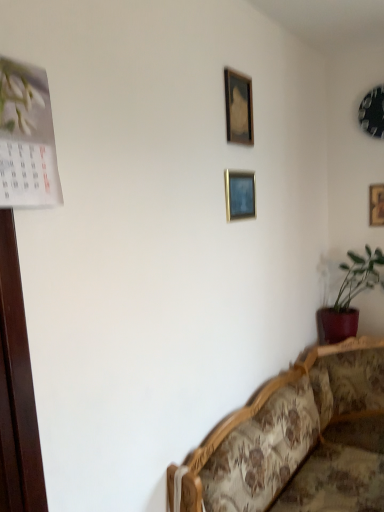
Question: Is matte wooden picture frame at upper center, the 2th picture frame from the front, surrounded by floral fabric couch at lower right?

Choices:
 (A) yes
 (B) no

Answer: (B)

Question: Does floral fabric couch at lower right have a lesser width compared to matte wooden picture frame at upper center, the third picture frame viewed from the back?

Choices:
 (A) yes
 (B) no

Answer: (B)

Question: Is floral fabric couch at lower right smaller than matte wooden picture frame at upper center, arranged as the second picture frame when viewed from the left?

Choices:
 (A) no
 (B) yes

Answer: (A)

Question: Is floral fabric couch at lower right taller than matte wooden picture frame at upper center, the 2th picture frame from the front?

Choices:
 (A) no
 (B) yes

Answer: (B)

Question: From the image's perspective, is floral fabric couch at lower right over matte wooden picture frame at upper center, arranged as the second picture frame when viewed from the left?

Choices:
 (A) yes
 (B) no

Answer: (B)

Question: From the image's perspective, relative to green matte plant at lower right, is floral fabric couch at lower right above or below?

Choices:
 (A) below
 (B) above

Answer: (A)

Question: Choose the correct answer: Is floral fabric couch at lower right inside green matte plant at lower right or outside it?

Choices:
 (A) outside
 (B) inside

Answer: (A)

Question: From a real-world perspective, relative to green matte plant at lower right, is floral fabric couch at lower right vertically above or below?

Choices:
 (A) above
 (B) below

Answer: (B)

Question: Is floral fabric couch at lower right to the left or to the right of green matte plant at lower right in the image?

Choices:
 (A) left
 (B) right

Answer: (A)

Question: Would you say green matte plant at lower right is to the left or to the right of metallic clock at upper right, the 2th picture frame from the right, in the picture?

Choices:
 (A) left
 (B) right

Answer: (A)

Question: Do you think green matte plant at lower right is within metallic clock at upper right, the third picture frame in the front-to-back sequence, or outside of it?

Choices:
 (A) outside
 (B) inside

Answer: (A)

Question: Is green matte plant at lower right taller or shorter than metallic clock at upper right, positioned as the 2th picture frame in back-to-front order?

Choices:
 (A) tall
 (B) short

Answer: (A)

Question: Is green matte plant at lower right wider or thinner than metallic clock at upper right, the third picture frame in the front-to-back sequence?

Choices:
 (A) wide
 (B) thin

Answer: (A)

Question: From the image's perspective, is green matte plant at lower right above or below wooden picture frame at upper center, the fourth picture frame from the right?

Choices:
 (A) above
 (B) below

Answer: (B)

Question: Is green matte plant at lower right situated inside wooden picture frame at upper center, which appears as the 1th picture frame when viewed from the front, or outside?

Choices:
 (A) outside
 (B) inside

Answer: (A)